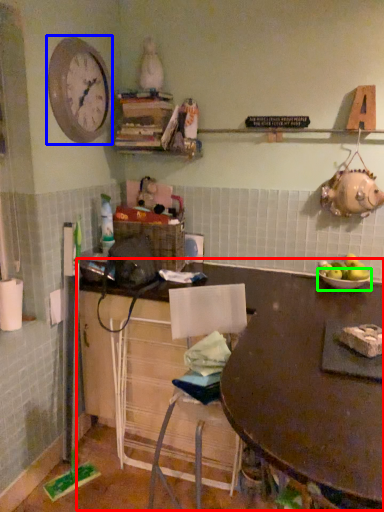
Question: Considering the real-world distances, which object is closest to table (highlighted by a red box)? clock (highlighted by a blue box) or bowl (highlighted by a green box).

Choices:
 (A) clock
 (B) bowl

Answer: (B)